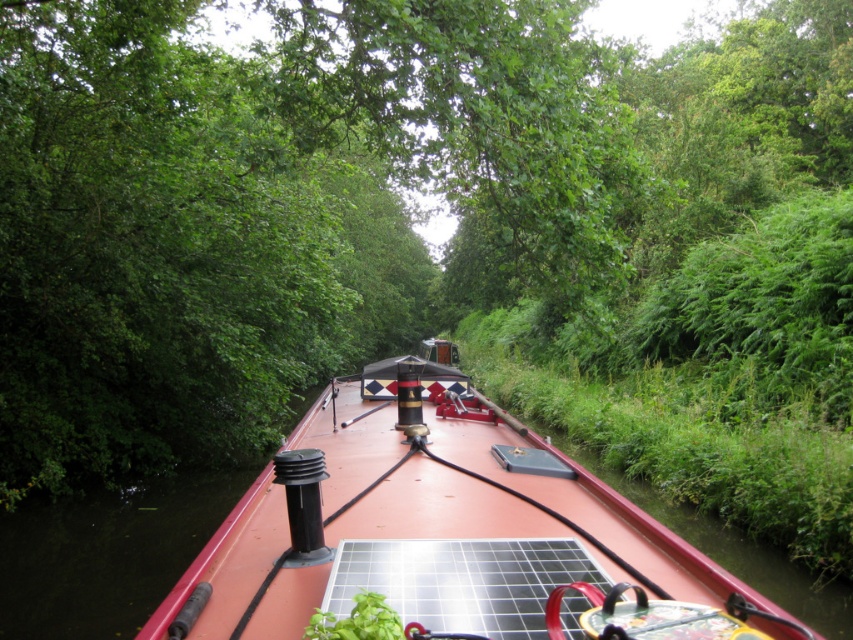
Between red matte boat at center and black solar panel at center, which one has less height?

Standing shorter between the two is black solar panel at center.

Does red matte boat at center have a greater width compared to black solar panel at center?

In fact, red matte boat at center might be narrower than black solar panel at center.

Between point (498, 582) and point (456, 572), which one is positioned in front?

Point (498, 582) is more forward.

Image resolution: width=853 pixels, height=640 pixels. I want to click on red matte boat at center, so click(433, 528).